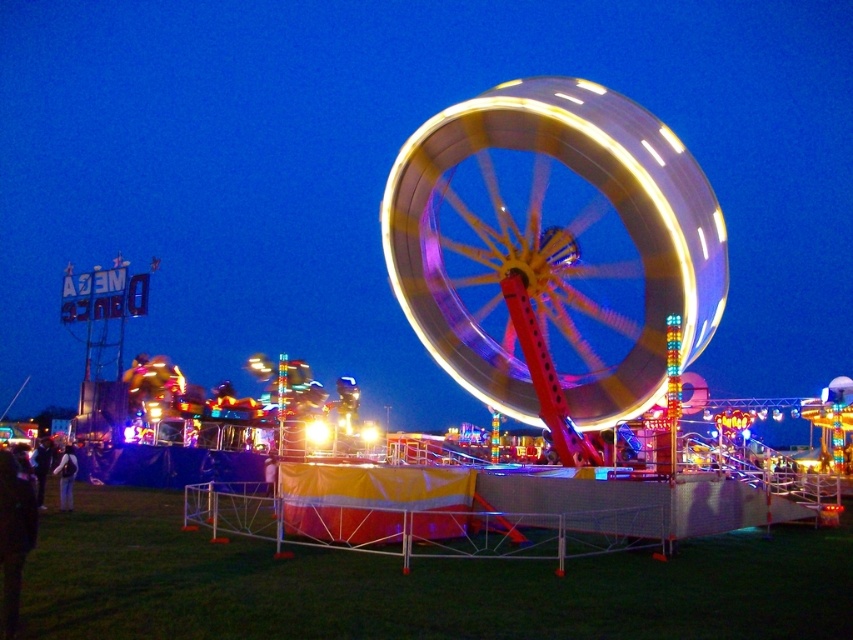
Is the position of metallic shiny roller coaster at center more distant than that of light blue jeans at lower left?

No, it is in front of light blue jeans at lower left.

Consider the image. Who is shorter, metallic shiny roller coaster at center or light blue jeans at lower left?

metallic shiny roller coaster at center

Who is more distant from viewer, [44,624] or [74,461]?

The point [74,461] is behind.

At what (x,y) coordinates should I click in order to perform the action: click on metallic shiny roller coaster at center. Please return your answer as a coordinate pair (x, y). Looking at the image, I should click on (413, 586).

Looking at this image, how distant is metallic yellow ferris wheel at center from metallic shiny roller coaster at center?

metallic yellow ferris wheel at center and metallic shiny roller coaster at center are 120.29 feet apart from each other.

Does metallic yellow ferris wheel at center appear over metallic shiny roller coaster at center?

Yes.

Where is `metallic yellow ferris wheel at center`? Image resolution: width=853 pixels, height=640 pixels. metallic yellow ferris wheel at center is located at coordinates (554, 243).

Can you confirm if light blue jeans at lower left is positioned below dark blue shirt at lower left?

Indeed, light blue jeans at lower left is positioned under dark blue shirt at lower left.

Who is lower down, light blue jeans at lower left or dark blue shirt at lower left?

light blue jeans at lower left

Measure the distance between point (67,451) and camera.

They are 91.75 meters apart.

The width and height of the screenshot is (853, 640). I want to click on light blue jeans at lower left, so click(67, 477).